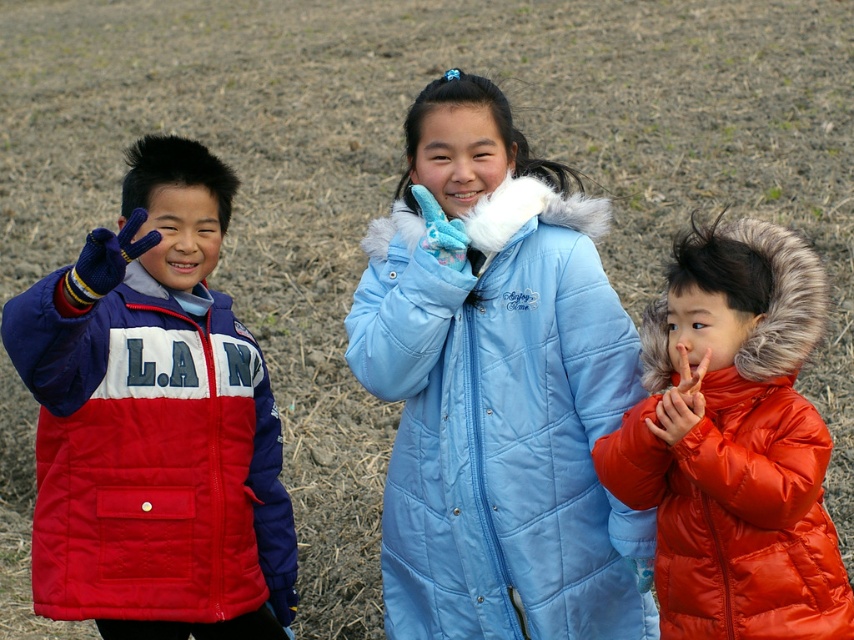
Is point (699, 600) positioned after point (683, 413)?

Yes, point (699, 600) is farther from viewer.

Locate an element on the screen. This screenshot has width=854, height=640. shiny orange puffer jacket at right is located at coordinates (x=733, y=442).

At what (x,y) coordinates should I click in order to perform the action: click on shiny orange puffer jacket at right. Please return your answer as a coordinate pair (x, y). This screenshot has width=854, height=640. Looking at the image, I should click on (733, 442).

Between light blue quilted jacket at center and shiny orange puffer jacket at right, which one has less height?

shiny orange puffer jacket at right is shorter.

Does light blue quilted jacket at center have a larger size compared to shiny orange puffer jacket at right?

Correct, light blue quilted jacket at center is larger in size than shiny orange puffer jacket at right.

Does point (402, 211) come closer to viewer compared to point (647, 324)?

No, it is not.

Find the location of a particular element. This screenshot has height=640, width=854. light blue quilted jacket at center is located at coordinates (502, 422).

Can you confirm if matte nylon jacket at left is positioned to the left of shiny orange puffer jacket at right?

Indeed, matte nylon jacket at left is positioned on the left side of shiny orange puffer jacket at right.

Is matte nylon jacket at left in front of shiny orange puffer jacket at right?

Yes, it is in front of shiny orange puffer jacket at right.

Find the location of a particular element. matte nylon jacket at left is located at coordinates (154, 422).